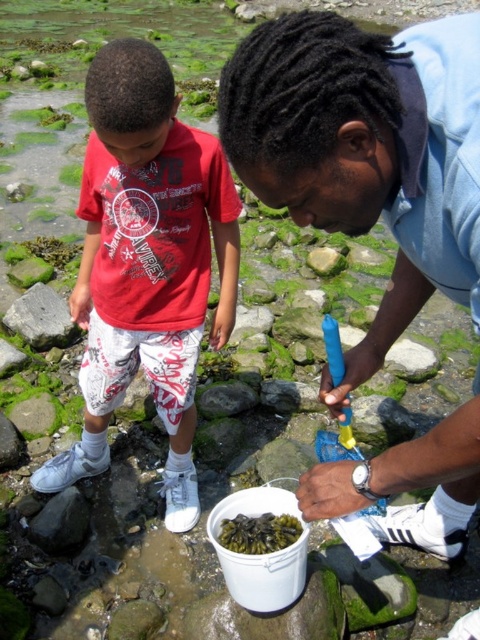
You are standing at the shoreline and want to pick up an object located at point (299, 525). There is another object at point (330, 516). Which point is closer to you?

Point (330, 516) is closer to you than point (299, 525).

You are standing at the shoreline and want to place a 5 feet long object between the gray rock at left and yourself. Is there enough space?

The distance between the gray rock at left and the viewer is 10.34 feet, so placing a 5 feet long object would fit as there is sufficient space.